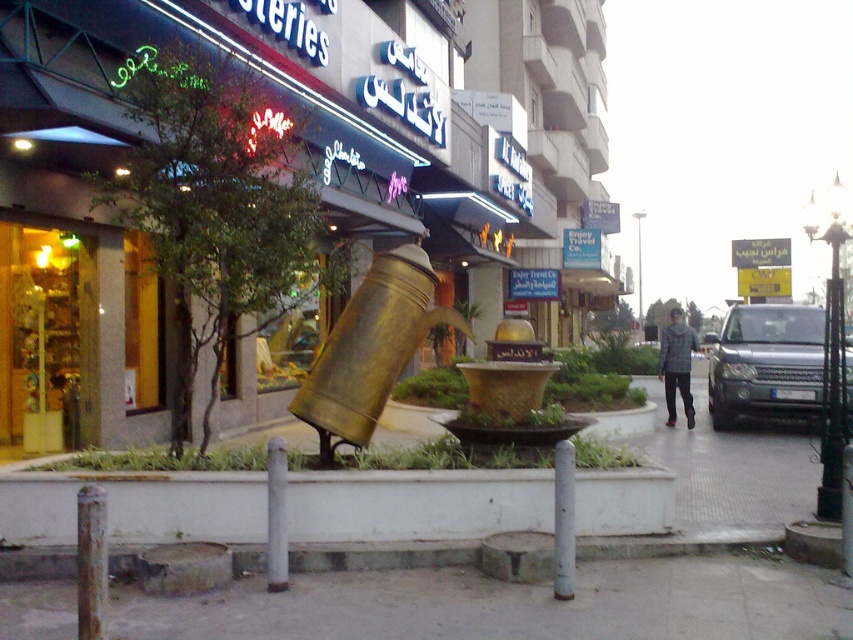
Does gray concrete pavement at lower center have a greater width compared to white concrete planter at lower center?

In fact, gray concrete pavement at lower center might be narrower than white concrete planter at lower center.

Is gray concrete pavement at lower center positioned at the back of white concrete planter at lower center?

No, gray concrete pavement at lower center is closer to the viewer.

You are a GUI agent. You are given a task and a screenshot of the screen. Output one action in this format:
    pyautogui.click(x=<x>, y=<y>)
    Task: Click on the gray concrete pavement at lower center
    This screenshot has width=853, height=640.
    Given the screenshot: What is the action you would take?
    pyautogui.click(x=511, y=604)

Which is in front, point (45, 154) or point (792, 307)?

Positioned in front is point (45, 154).

Where is `gold metallic teapot at center`? gold metallic teapot at center is located at coordinates (305, 157).

Locate an element on the screen. gold metallic teapot at center is located at coordinates (305, 157).

Can you confirm if gold metallic watering can at center is positioned below silver metallic suv at right?

No, gold metallic watering can at center is not below silver metallic suv at right.

Which is above, gold metallic watering can at center or silver metallic suv at right?

gold metallic watering can at center is higher up.

Where is `gold metallic watering can at center`? gold metallic watering can at center is located at coordinates (370, 348).

Locate an element on the screen. This screenshot has width=853, height=640. gold metallic watering can at center is located at coordinates [x=370, y=348].